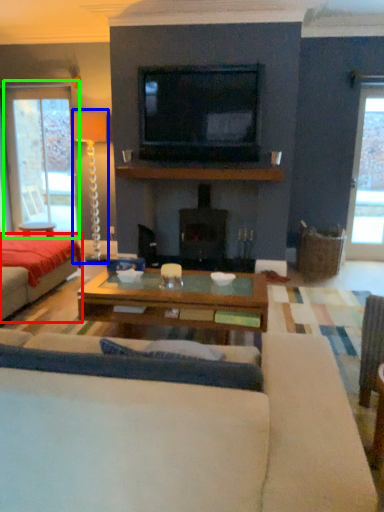
Question: Based on their relative distances, which object is nearer to bed (highlighted by a red box)? Choose from lamp (highlighted by a blue box) and window (highlighted by a green box).

Choices:
 (A) lamp
 (B) window

Answer: (B)